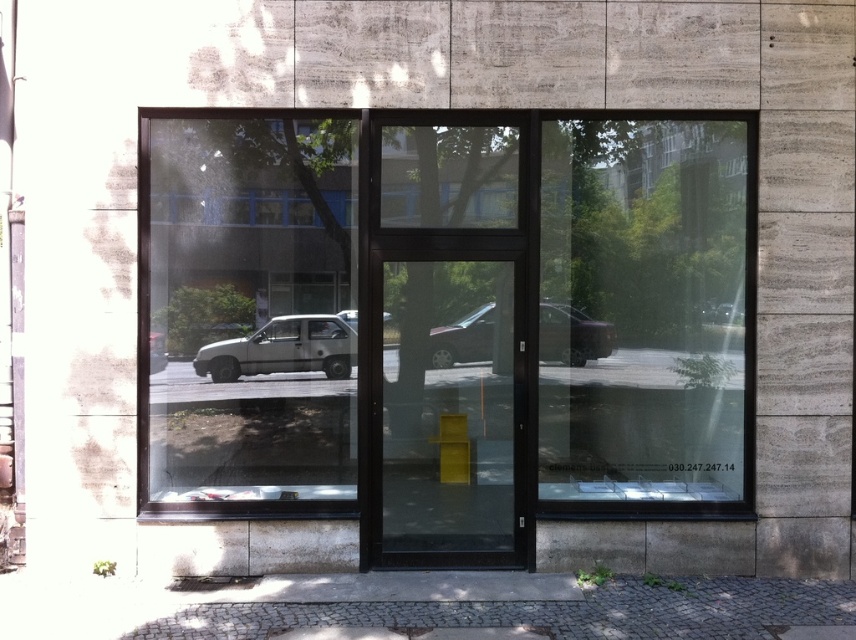
Question: Estimate the real-world distances between objects in this image. Which object is farther from the metallic silver car at center?

Choices:
 (A) transparent glass window at left
 (B) transparent glass door at center
 (C) silver metallic car at center

Answer: (A)

Question: From the image, what is the correct spatial relationship of silver metallic car at center in relation to metallic silver car at center?

Choices:
 (A) above
 (B) below

Answer: (B)

Question: Can you confirm if transparent glass door at center is positioned to the left of silver metallic car at center?

Choices:
 (A) yes
 (B) no

Answer: (B)

Question: Can you confirm if transparent glass window at left is positioned to the left of transparent glass door at center?

Choices:
 (A) yes
 (B) no

Answer: (A)

Question: Estimate the real-world distances between objects in this image. Which object is closer to the silver metallic car at center?

Choices:
 (A) transparent glass door at center
 (B) metallic silver car at center
 (C) transparent glass window at left

Answer: (C)

Question: Among these points, which one is farthest from the camera?

Choices:
 (A) (438, 234)
 (B) (339, 170)

Answer: (B)